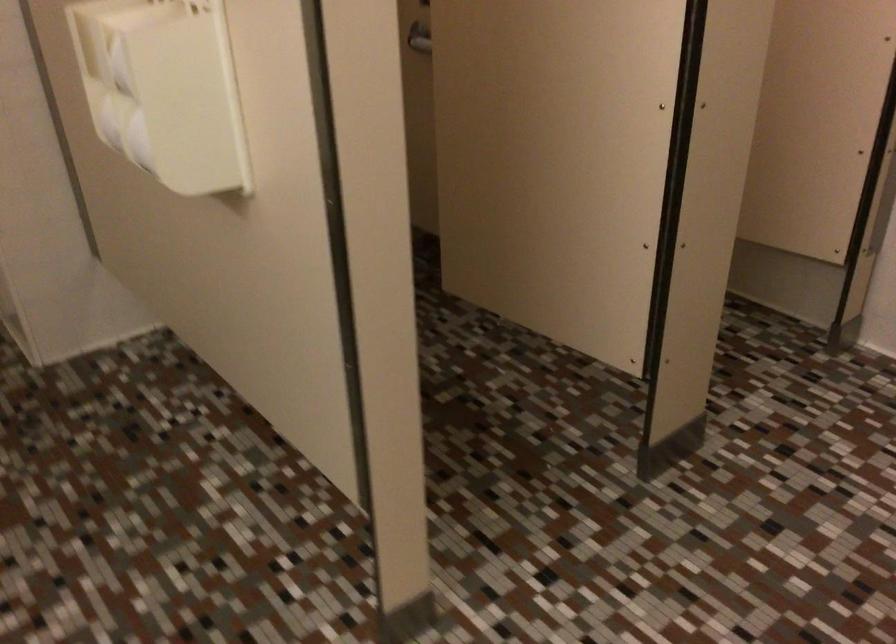
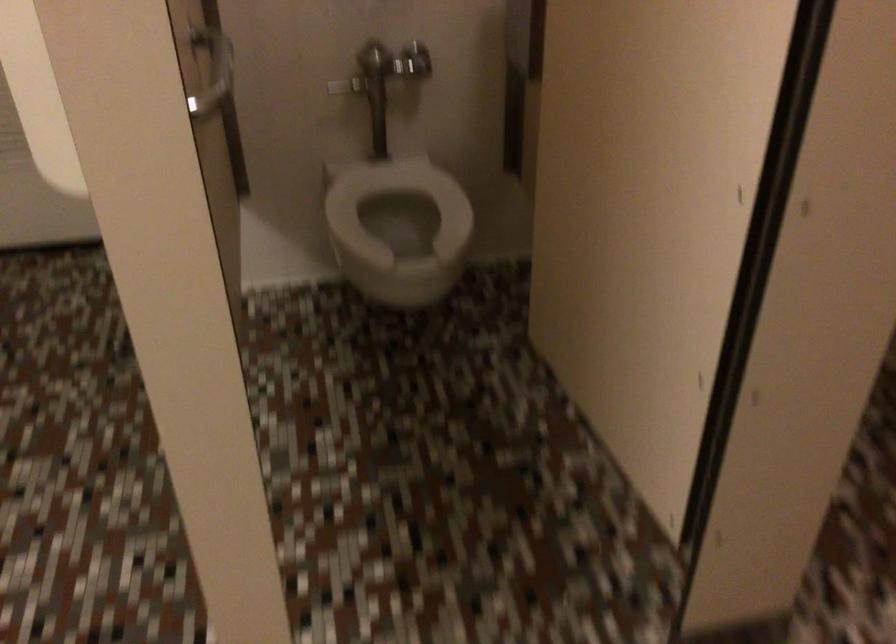
From the picture: Which direction would the cameraman need to move to produce the second image?

The cameraman walked toward right, forward.